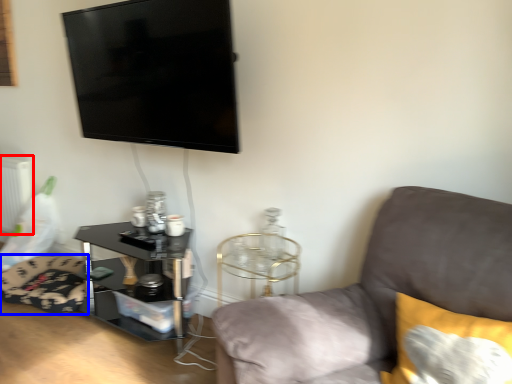
Question: Which of the following is the farthest to the observer, radiator (highlighted by a red box) or swivel chair (highlighted by a blue box)?

Choices:
 (A) radiator
 (B) swivel chair

Answer: (A)